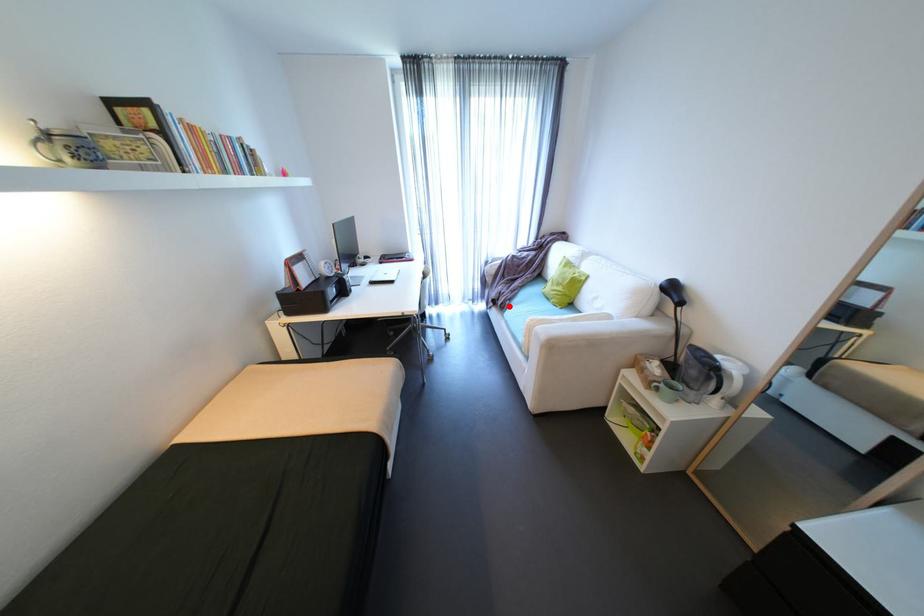
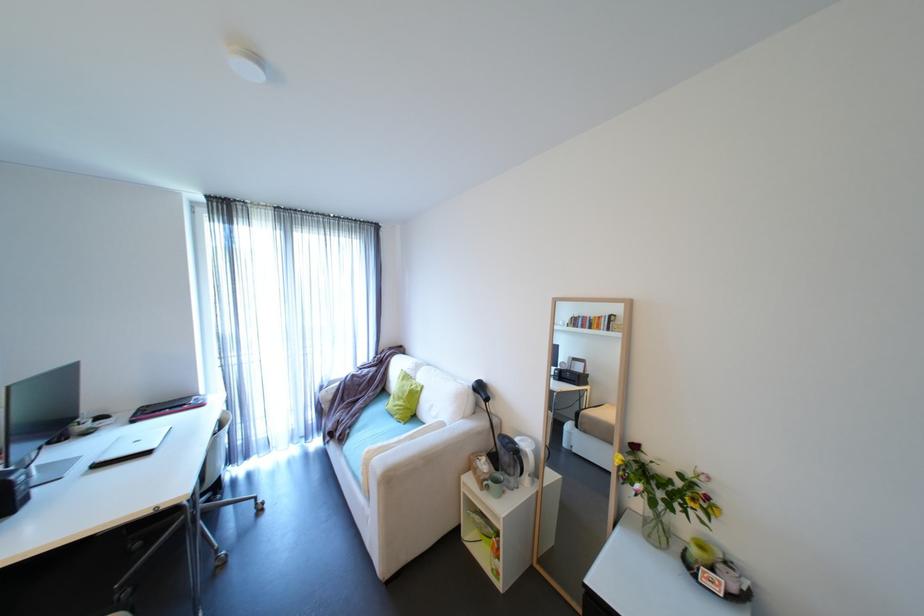
Question: I am providing you with two images of the same scene from different viewpoints. A red point is shown in image1. For the corresponding object point in image2, is it positioned nearer or farther from the camera?

Choices:
 (A) Nearer
 (B) Farther

Answer: (B)